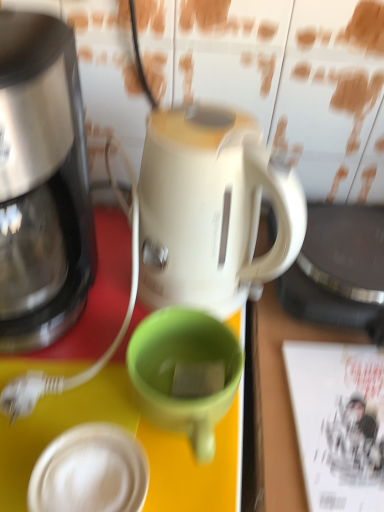
Question: Is green matte mug at center not close to shiny metallic coffee maker at left?

Choices:
 (A) no
 (B) yes

Answer: (A)

Question: Is green matte mug at center positioned beyond the bounds of shiny metallic coffee maker at left?

Choices:
 (A) yes
 (B) no

Answer: (A)

Question: From a real-world perspective, does green matte mug at center sit lower than shiny metallic coffee maker at left?

Choices:
 (A) yes
 (B) no

Answer: (A)

Question: From a real-world perspective, is green matte mug at center over shiny metallic coffee maker at left?

Choices:
 (A) no
 (B) yes

Answer: (A)

Question: From the image's perspective, is green matte mug at center over shiny metallic coffee maker at left?

Choices:
 (A) no
 (B) yes

Answer: (A)

Question: Considering the positions of point (340, 449) and point (175, 404), is point (340, 449) closer or farther from the camera than point (175, 404)?

Choices:
 (A) closer
 (B) farther

Answer: (B)

Question: From the image's perspective, is white paper magazine at right positioned above or below green matte mug at center?

Choices:
 (A) below
 (B) above

Answer: (A)

Question: In terms of width, does white paper magazine at right look wider or thinner when compared to green matte mug at center?

Choices:
 (A) wide
 (B) thin

Answer: (A)

Question: In terms of height, does white paper magazine at right look taller or shorter compared to green matte mug at center?

Choices:
 (A) tall
 (B) short

Answer: (B)

Question: Considering the positions of shiny metallic coffee maker at left and white paper magazine at right in the image, is shiny metallic coffee maker at left bigger or smaller than white paper magazine at right?

Choices:
 (A) small
 (B) big

Answer: (B)

Question: Considering the positions of shiny metallic coffee maker at left and white paper magazine at right in the image, is shiny metallic coffee maker at left wider or thinner than white paper magazine at right?

Choices:
 (A) thin
 (B) wide

Answer: (B)

Question: Considering the relative positions of shiny metallic coffee maker at left and white paper magazine at right in the image provided, is shiny metallic coffee maker at left to the left or to the right of white paper magazine at right?

Choices:
 (A) left
 (B) right

Answer: (A)

Question: Is shiny metallic coffee maker at left taller or shorter than white paper magazine at right?

Choices:
 (A) tall
 (B) short

Answer: (A)

Question: Is white matte lid at lower left in front of or behind white paper magazine at right in the image?

Choices:
 (A) behind
 (B) front

Answer: (B)

Question: Is white matte lid at lower left taller or shorter than white paper magazine at right?

Choices:
 (A) short
 (B) tall

Answer: (B)